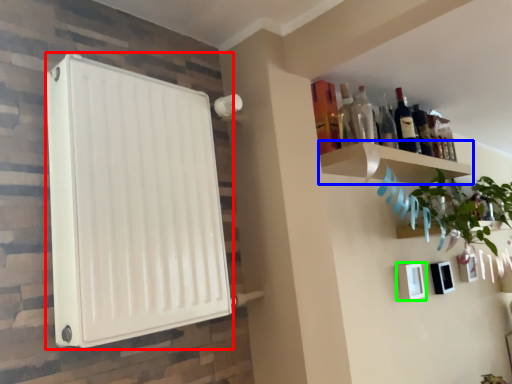
Question: Which object is the closest to the appliance (highlighted by a red box)? Choose among these: shelf (highlighted by a blue box) or picture frame (highlighted by a green box).

Choices:
 (A) shelf
 (B) picture frame

Answer: (A)